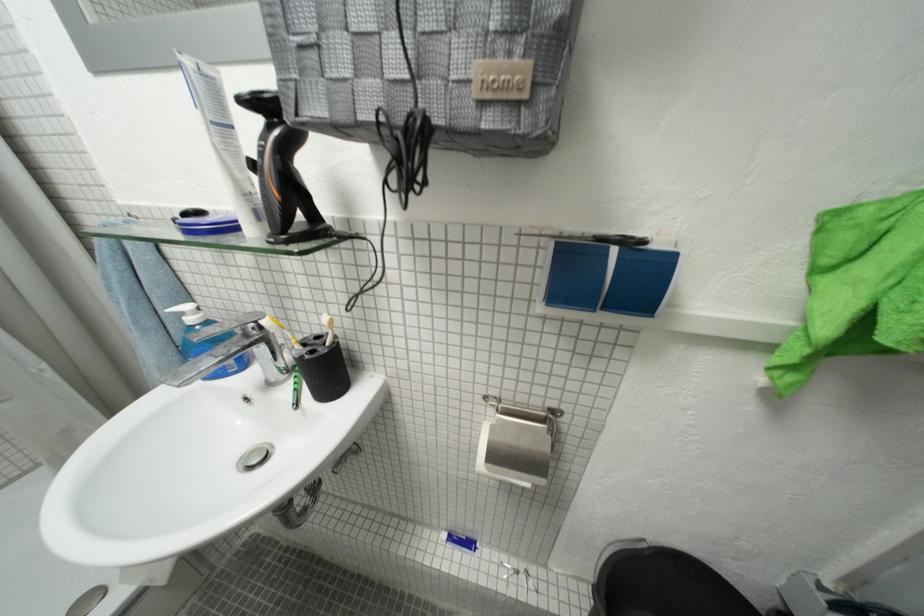
Where would you lift the black electric razor? Please return your answer as a coordinate pair (x, y).

(281, 172)